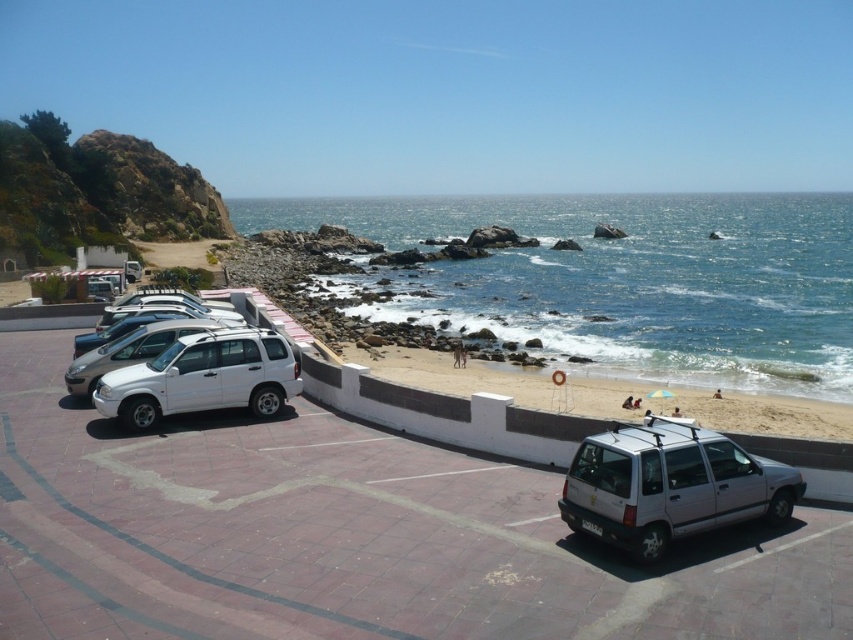
Can you confirm if silver metallic minivan at lower right is wider than white matte suv at center-left?

In fact, silver metallic minivan at lower right might be narrower than white matte suv at center-left.

Is silver metallic minivan at lower right bigger than white matte suv at center-left?

No, silver metallic minivan at lower right is not bigger than white matte suv at center-left.

Is point (640, 536) less distant than point (102, 374)?

Yes, point (640, 536) is closer to viewer.

You are a GUI agent. You are given a task and a screenshot of the screen. Output one action in this format:
    pyautogui.click(x=<x>, y=<y>)
    Task: Click on the silver metallic minivan at lower right
    
    Given the screenshot: What is the action you would take?
    pyautogui.click(x=669, y=484)

Can you confirm if blue water at lower right is thinner than silver metallic minivan at lower right?

No, blue water at lower right is not thinner than silver metallic minivan at lower right.

Does blue water at lower right appear over silver metallic minivan at lower right?

Indeed, blue water at lower right is positioned over silver metallic minivan at lower right.

Is point (392, 211) positioned in front of point (643, 509)?

No.

You are a GUI agent. You are given a task and a screenshot of the screen. Output one action in this format:
    pyautogui.click(x=<x>, y=<y>)
    Task: Click on the blue water at lower right
    The image size is (853, 640).
    Given the screenshot: What is the action you would take?
    pyautogui.click(x=621, y=280)

Does blue water at lower right lie in front of white matte suv at center-left?

No, blue water at lower right is behind white matte suv at center-left.

Who is more forward, (x=515, y=291) or (x=180, y=356)?

Point (x=180, y=356) is more forward.

The image size is (853, 640). In order to click on blue water at lower right in this screenshot , I will do `click(621, 280)`.

Image resolution: width=853 pixels, height=640 pixels. I want to click on blue water at lower right, so click(x=621, y=280).